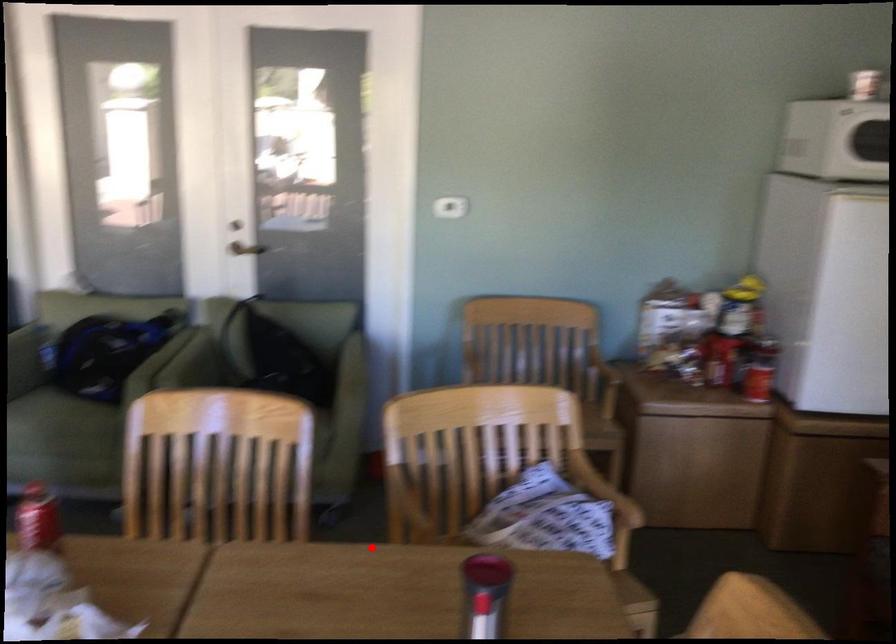
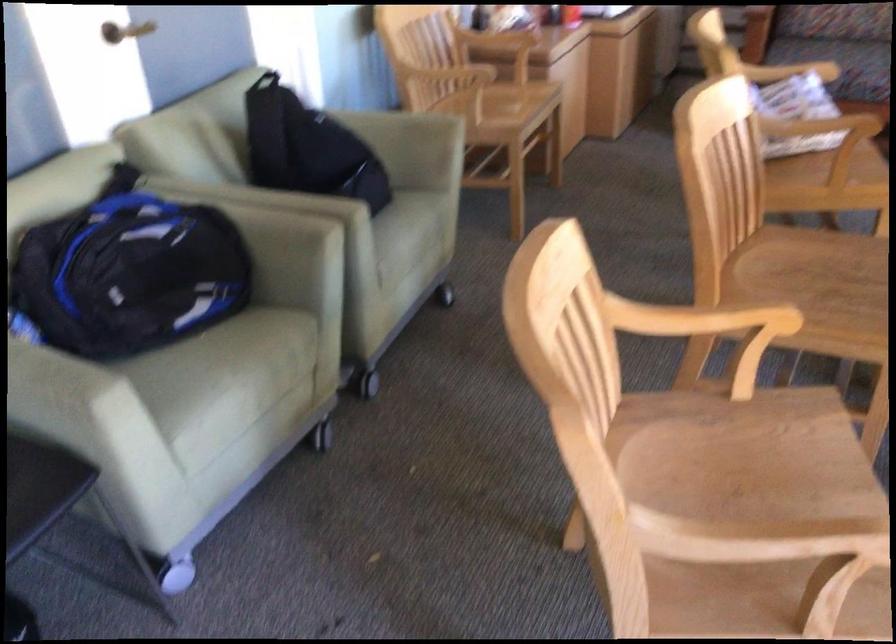
Locate, in the second image, the point that corresponds to the highlighted location in the first image.

(823, 126)